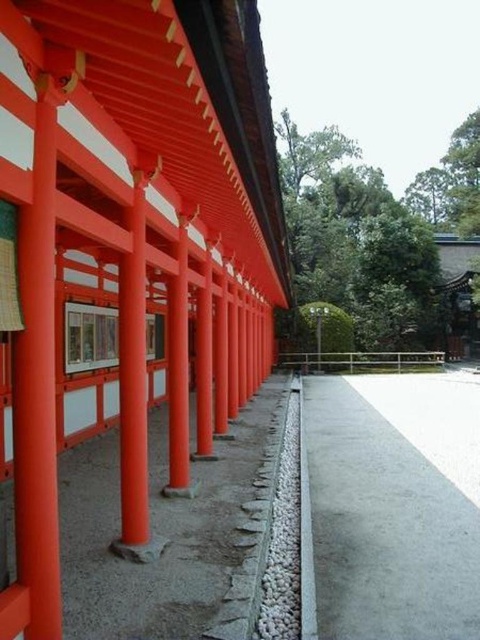
This screenshot has height=640, width=480. What do you see at coordinates (126, 244) in the screenshot?
I see `matte orange pillars at center` at bounding box center [126, 244].

Is matte orange pillars at center smaller than gray concrete path at lower center?

Incorrect, matte orange pillars at center is not smaller in size than gray concrete path at lower center.

Measure the distance between matte orange pillars at center and camera.

6.81 feet

This screenshot has height=640, width=480. I want to click on matte orange pillars at center, so click(126, 244).

Is point (389, 632) positioned in front of point (28, 321)?

No, it is behind (28, 321).

I want to click on gray concrete path at lower center, so click(384, 525).

In the scene shown: Which is more to the right, matte orange pillars at center or matte orange post at center?

From the viewer's perspective, matte orange post at center appears more on the right side.

Consider the image. Who is lower down, matte orange pillars at center or matte orange post at center?

matte orange post at center is below.

Between point (196, 19) and point (176, 353), which one is positioned behind?

Point (176, 353)

Where is `matte orange pillars at center`? The image size is (480, 640). matte orange pillars at center is located at coordinates (126, 244).